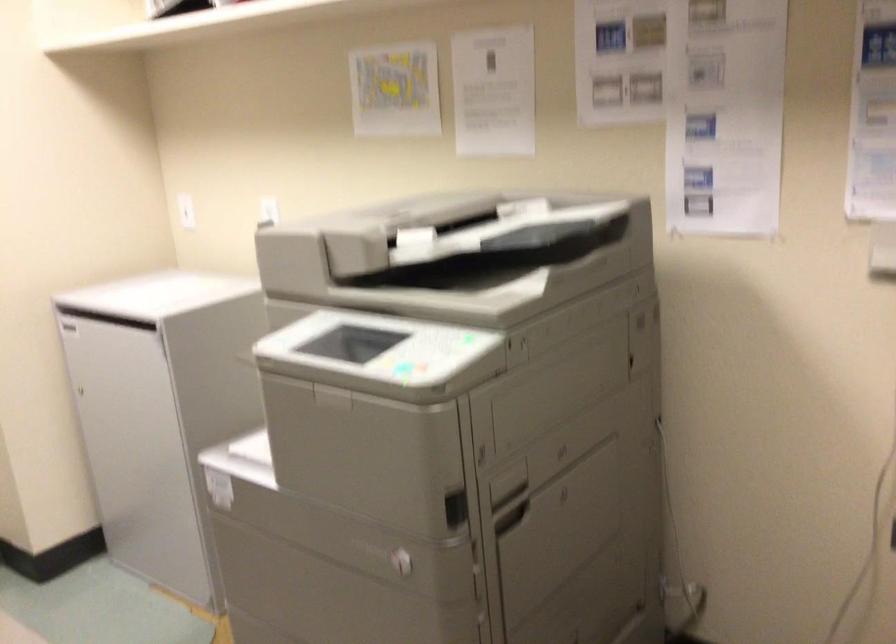
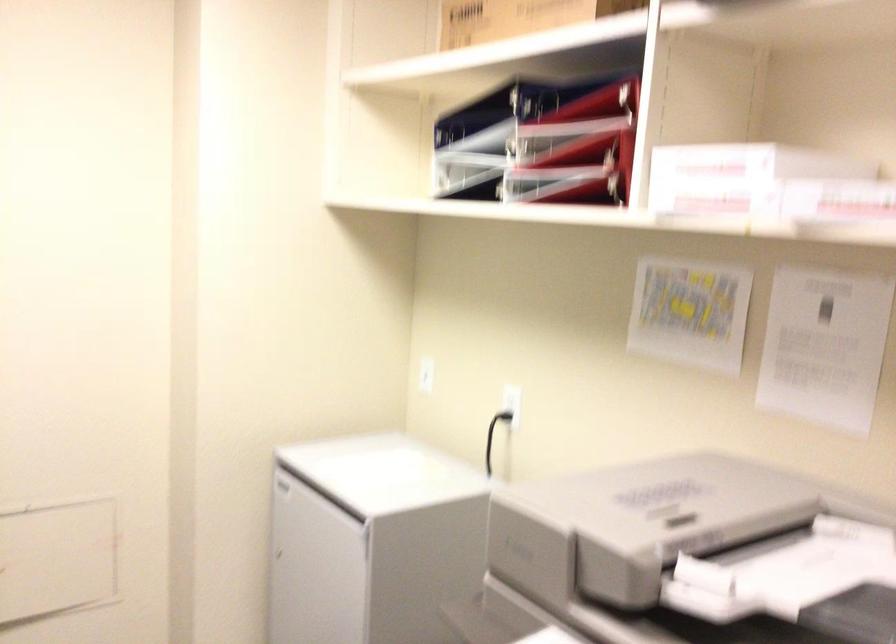
The images are taken continuously from a first-person perspective. In which direction are you moving?

The movement direction of the cameraman is left, forward.